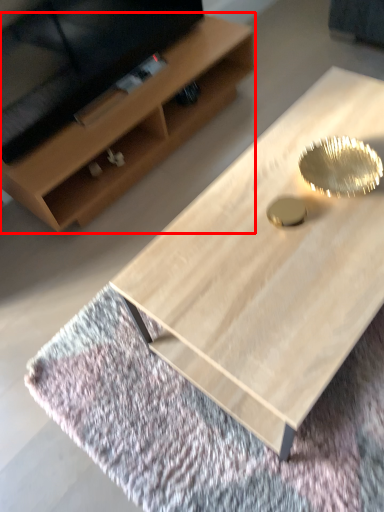
Question: Where is shelf (annotated by the red box) located in relation to coffee table in the image?

Choices:
 (A) right
 (B) left

Answer: (B)